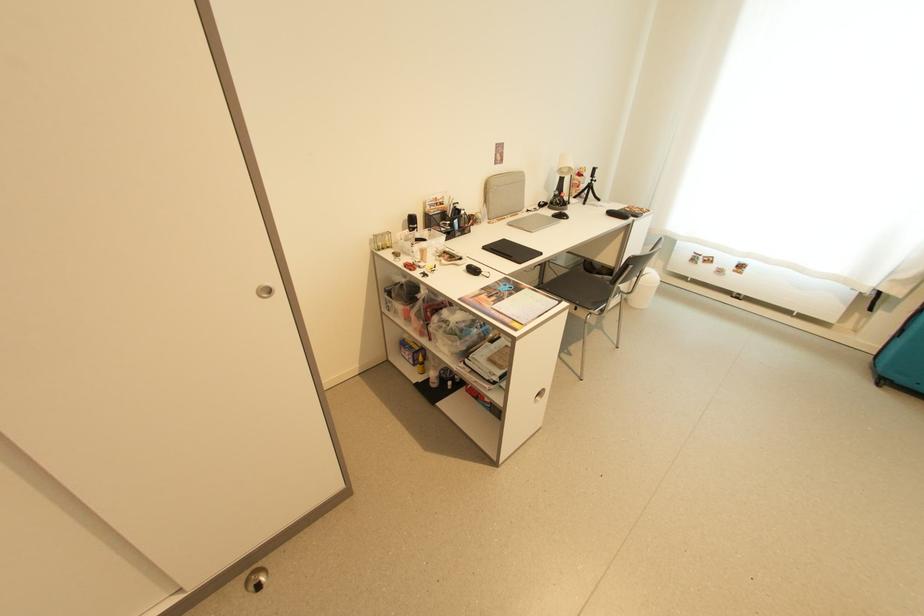
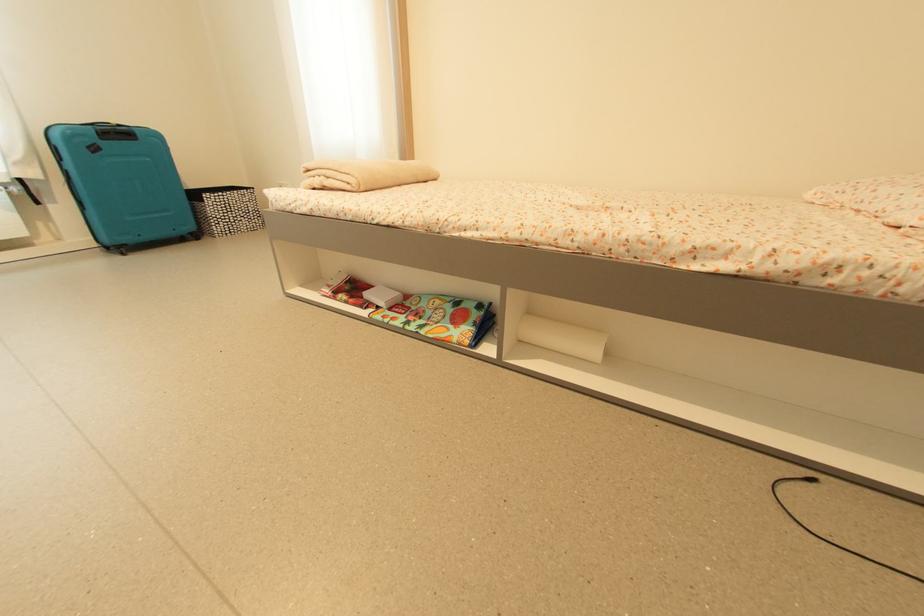
First-person continuous shooting, in which direction is the camera rotating?

The rotation direction of the camera is right-down.